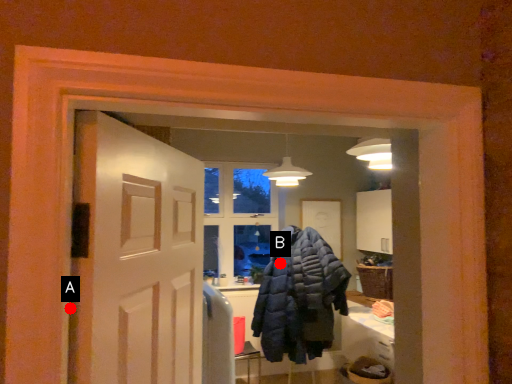
Question: Two points are circled on the image, labeled by A and B beside each circle. Which point is farther from the camera taking this photo?

Choices:
 (A) A is further
 (B) B is further

Answer: (B)